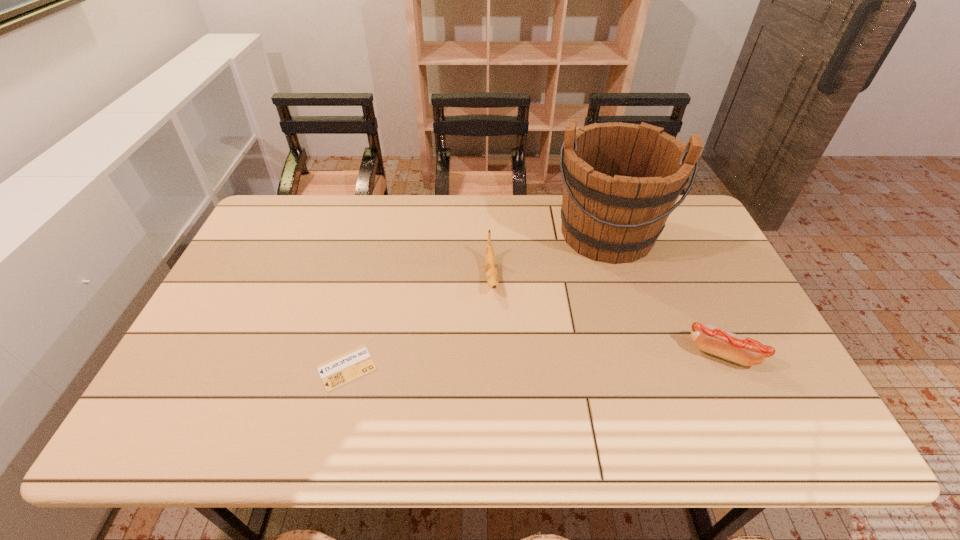
Find the location of a particular element. The height and width of the screenshot is (540, 960). object that is positioned at the near right corner is located at coordinates (742, 350).

I want to click on blank space at the far edge, so click(372, 211).

Identify the location of vacant space at the near edge of the desktop. Image resolution: width=960 pixels, height=540 pixels. (508, 380).

Image resolution: width=960 pixels, height=540 pixels. I want to click on free space at the left edge, so click(x=246, y=272).

Find the location of `free space at the right edge of the desktop`. free space at the right edge of the desktop is located at coordinates (680, 271).

Identify the location of vacant space at the far left corner. The height and width of the screenshot is (540, 960). (274, 199).

Where is `vacant space at the near left corner of the desktop`? The width and height of the screenshot is (960, 540). vacant space at the near left corner of the desktop is located at coordinates (196, 379).

In the image, there is a desktop. What are the coordinates of `vacant space at the near right corner` in the screenshot? It's located at (729, 380).

What are the coordinates of `free spot between the sausage and the leftmost object` in the screenshot? It's located at (535, 360).

Identify the location of free space between the wine bucket and the second shortest object. The height and width of the screenshot is (540, 960). (664, 293).